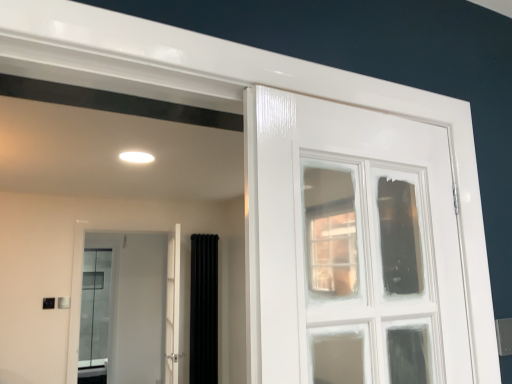
Question: Could you tell me if black velvet curtain at center is facing white glossy door at center?

Choices:
 (A) yes
 (B) no

Answer: (B)

Question: Is black velvet curtain at center bigger than white glossy door at center?

Choices:
 (A) yes
 (B) no

Answer: (B)

Question: Can you confirm if black velvet curtain at center is smaller than white glossy door at center?

Choices:
 (A) yes
 (B) no

Answer: (A)

Question: From the image's perspective, is black velvet curtain at center on top of white glossy door at center?

Choices:
 (A) no
 (B) yes

Answer: (A)

Question: From a real-world perspective, is black velvet curtain at center positioned under white glossy door at center based on gravity?

Choices:
 (A) yes
 (B) no

Answer: (A)

Question: Does black velvet curtain at center have a greater width compared to white glossy door at center?

Choices:
 (A) yes
 (B) no

Answer: (A)

Question: Is white glossy door at center aimed at black velvet curtain at center?

Choices:
 (A) no
 (B) yes

Answer: (A)

Question: Would you say white glossy door at center contains black velvet curtain at center?

Choices:
 (A) yes
 (B) no

Answer: (B)

Question: From a real-world perspective, does white glossy door at center sit lower than black velvet curtain at center?

Choices:
 (A) no
 (B) yes

Answer: (A)

Question: Can you confirm if white glossy door at center is positioned to the left of black velvet curtain at center?

Choices:
 (A) no
 (B) yes

Answer: (B)

Question: From the image's perspective, is white glossy door at center under black velvet curtain at center?

Choices:
 (A) yes
 (B) no

Answer: (B)

Question: Considering the relative sizes of white glossy door at center and black velvet curtain at center in the image provided, is white glossy door at center taller than black velvet curtain at center?

Choices:
 (A) yes
 (B) no

Answer: (B)

Question: Is black velvet curtain at center located outside white glossy door at center?

Choices:
 (A) yes
 (B) no

Answer: (A)